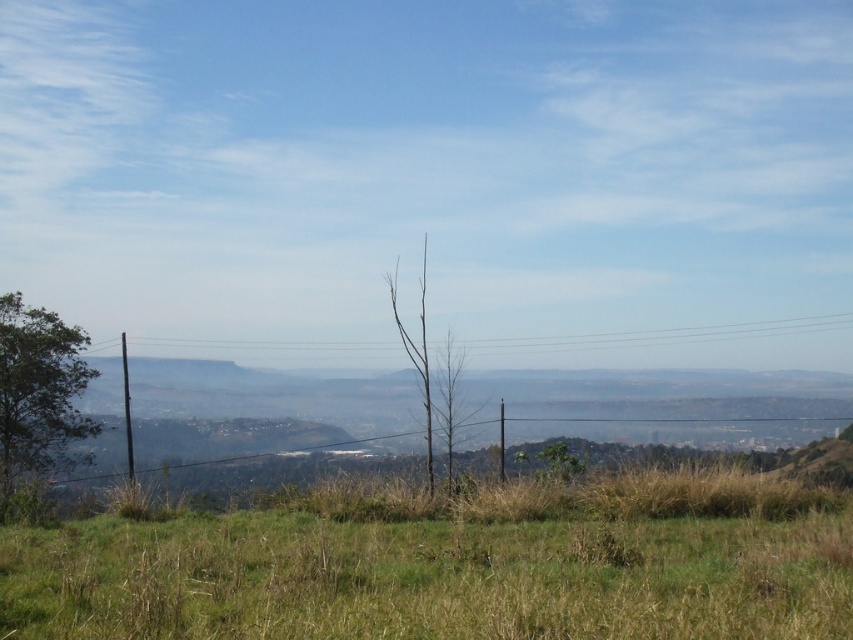
You are a gardener who needs to mow the green grass at lower center. However, you notice the bare wood tree at center nearby. Considering their heights, will the tree block sunlight from reaching the grass?

The green grass at lower center is not as tall as the bare wood tree at center, but since the tree is taller, it may cast shadows over the grass, potentially blocking sunlight depending on the time of day and the tree canopy. However, since the tree is described as bare, it lacks leaves, so sunlight can pass through the branches more easily than if it were leafy. Therefore, the tree might not significantly block sunlight from reaching the grass.

You are standing at the bottom edge of the image and want to walk towards the green grass at lower center. Which direction should you head?

You should head towards the center direction since the green grass at lower center is located at point [454,564], which is slightly to the right of the exact center but still within the lower central area.